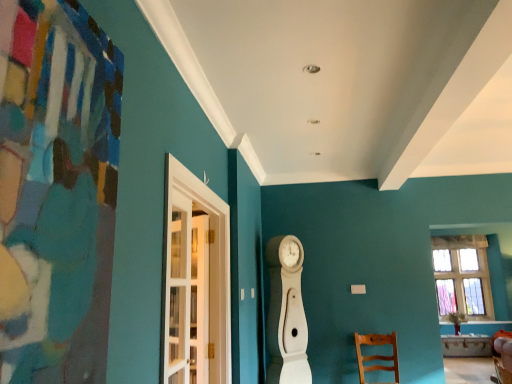
Question: Relative to white glass door at left, is wooden chair at lower right in front or behind?

Choices:
 (A) front
 (B) behind

Answer: (B)

Question: In the image, is wooden chair at lower right on the left side or the right side of white glass door at left?

Choices:
 (A) right
 (B) left

Answer: (A)

Question: Based on their relative distances, which object is nearer to the wooden chair at lower right?

Choices:
 (A) clear glass window at right
 (B) white glass door at left

Answer: (A)

Question: Which object is the farthest from the clear glass window at right?

Choices:
 (A) white glass door at left
 (B) wooden chair at lower right

Answer: (A)